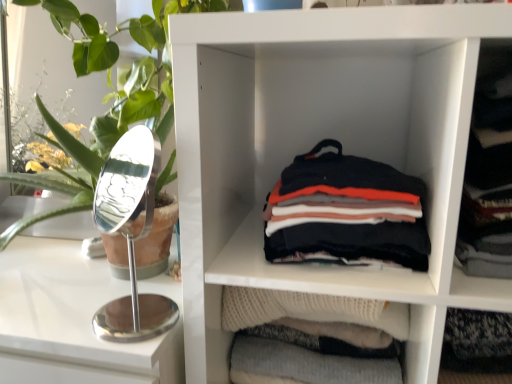
Question: From their relative heights in the image, would you say dark gray sweater at right is taller or shorter than soft cotton shirts at center?

Choices:
 (A) short
 (B) tall

Answer: (B)

Question: Considering the positions of point (508, 205) and point (369, 236), is point (508, 205) closer or farther from the camera than point (369, 236)?

Choices:
 (A) closer
 (B) farther

Answer: (A)

Question: Which is nearer to the soft cotton shirts at center?

Choices:
 (A) green leafy plant at left
 (B) white matte shelf at center
 (C) white glossy counter at left
 (D) dark gray sweater at right

Answer: (B)

Question: Which object is positioned closest to the green leafy plant at left?

Choices:
 (A) white matte shelf at center
 (B) dark gray sweater at right
 (C) soft cotton shirts at center
 (D) white glossy counter at left

Answer: (D)